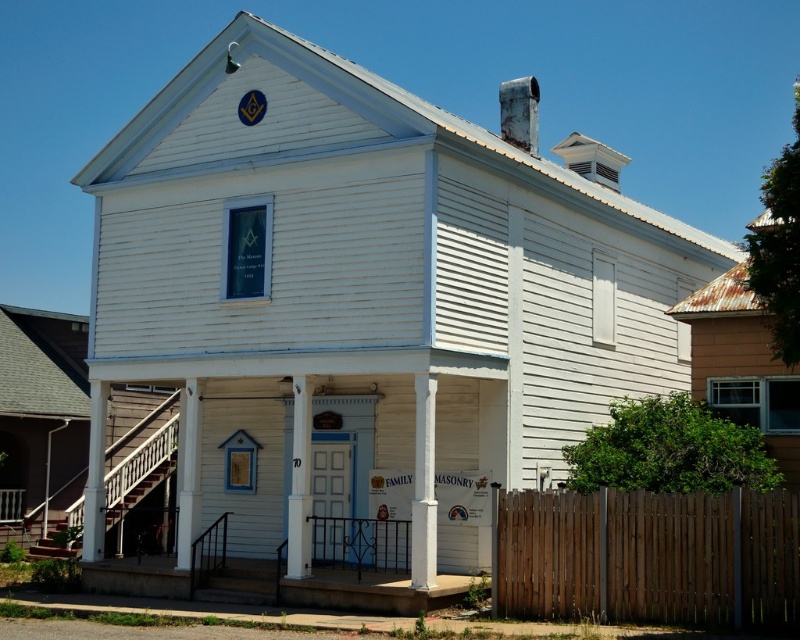
Question: Does white wood pillar at center appear on the left side of white painted wood post at center?

Choices:
 (A) no
 (B) yes

Answer: (A)

Question: Does brown wooden fence at lower right come in front of white painted wood post at center?

Choices:
 (A) no
 (B) yes

Answer: (B)

Question: Which object is the closest to the brown wooden fence at lower right?

Choices:
 (A) white painted wood post at center
 (B) white wood pillar at center

Answer: (B)

Question: Which of the following is the closest to the observer?

Choices:
 (A) (426, 417)
 (B) (674, 540)

Answer: (B)

Question: Which object is closer to the camera taking this photo?

Choices:
 (A) white painted wood post at center
 (B) white wood pillar at center

Answer: (B)

Question: Does white wood pillar at center have a larger size compared to white painted wood post at center?

Choices:
 (A) yes
 (B) no

Answer: (A)